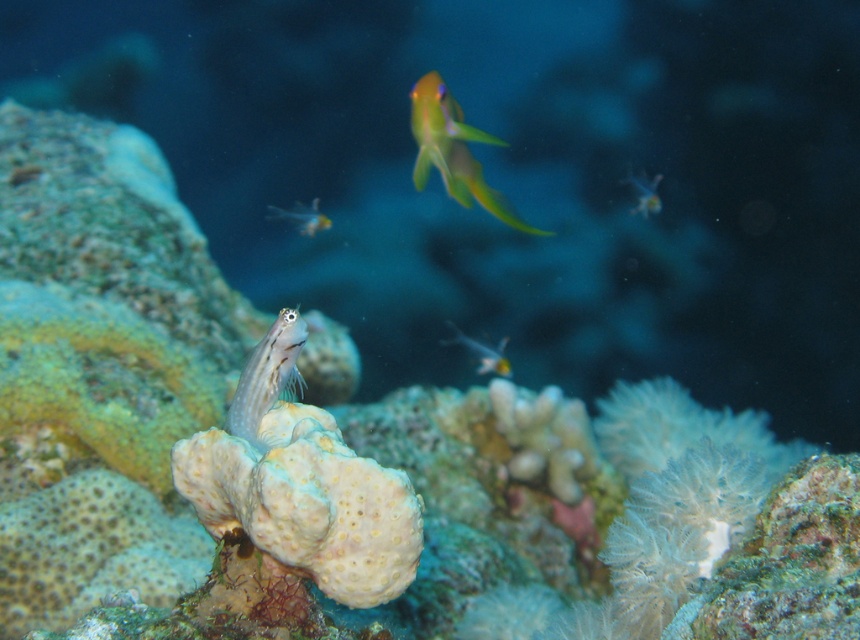
Is translucent glass fish at center to the right of translucent glass fish at upper right from the viewer's perspective?

In fact, translucent glass fish at center is to the left of translucent glass fish at upper right.

Does translucent glass fish at center have a lesser width compared to translucent glass fish at upper right?

No.

Where is `translucent glass fish at center`? This screenshot has width=860, height=640. translucent glass fish at center is located at coordinates (482, 352).

Which is behind, point (289, 316) or point (273, 205)?

Point (273, 205)

Is point (281, 384) positioned before point (311, 205)?

Yes, point (281, 384) is in front of point (311, 205).

Does point (283, 380) come behind point (303, 218)?

No, (283, 380) is closer to viewer.

In order to click on translucent blue fish at center in this screenshot , I will do `click(268, 378)`.

Is green translucent fish at upper center below translucent yellow fish at upper center?

No.

Locate an element on the screen. green translucent fish at upper center is located at coordinates (453, 150).

Is point (432, 88) positioned after point (298, 211)?

That is False.

I want to click on green translucent fish at upper center, so click(x=453, y=150).